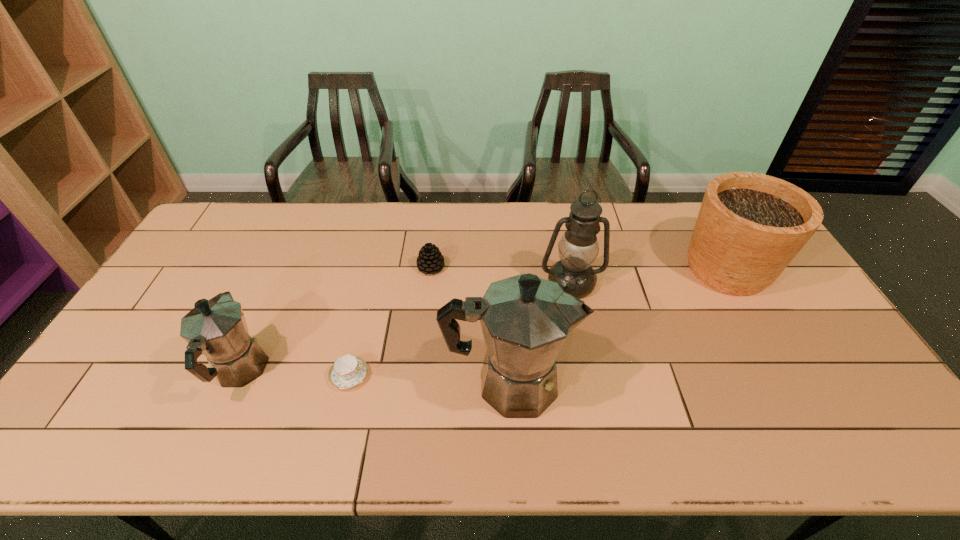
I want to click on object that is at the far right corner, so click(x=750, y=226).

In the image, there is a desktop. Find the location of `vacant space at the far edge`. vacant space at the far edge is located at coordinates (487, 225).

Where is `free region at the near edge of the desktop`? The height and width of the screenshot is (540, 960). free region at the near edge of the desktop is located at coordinates (726, 387).

Where is `blank space at the left edge of the desktop`? The image size is (960, 540). blank space at the left edge of the desktop is located at coordinates (146, 323).

At what (x,y) coordinates should I click in order to perform the action: click on free space that is in between the pinecone and the fifth object from right to left. Please return your answer as a coordinate pair (x, y). The width and height of the screenshot is (960, 540). Looking at the image, I should click on (391, 321).

The width and height of the screenshot is (960, 540). In order to click on blank region between the taller coffeepot and the left coffeepot in this screenshot , I will do `click(374, 377)`.

Image resolution: width=960 pixels, height=540 pixels. In order to click on free area in between the fifth tallest object and the oil lamp in this screenshot , I will do `click(501, 275)`.

Image resolution: width=960 pixels, height=540 pixels. I want to click on free spot between the shortest object and the taller coffeepot, so click(x=429, y=380).

At what (x,y) coordinates should I click in order to perform the action: click on free space between the second shortest object and the oil lamp. Please return your answer as a coordinate pair (x, y). Looking at the image, I should click on (501, 275).

This screenshot has width=960, height=540. What are the coordinates of `free spot between the oil lamp and the left coffeepot` in the screenshot? It's located at (405, 327).